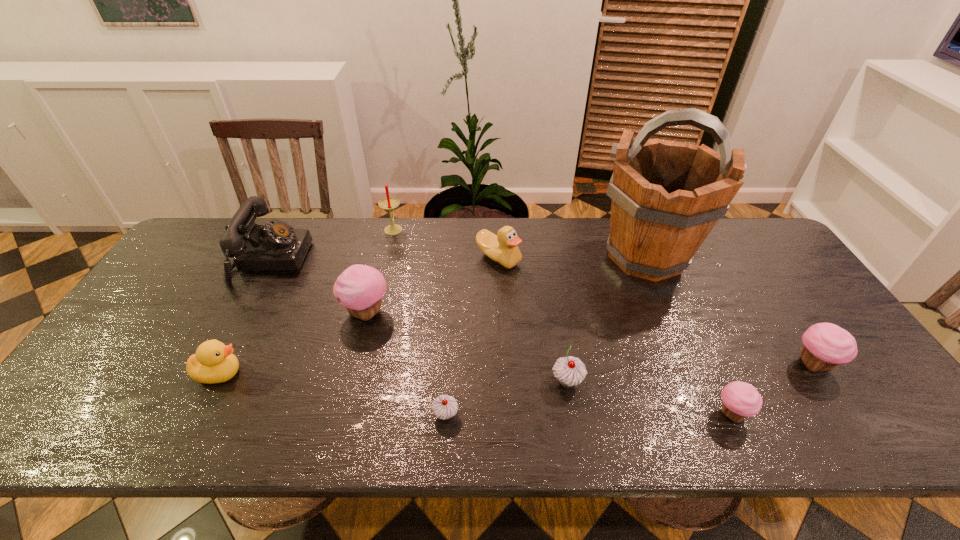
Locate an element on the screen. Image resolution: width=960 pixels, height=540 pixels. vacant space located 0.150m at the beak of the sixth object from left to right is located at coordinates (501, 310).

Find the location of a particular element. The height and width of the screenshot is (540, 960). vacant region located 0.130m on the right of the third cupcake from left to right is located at coordinates (638, 381).

Locate an element on the screen. This screenshot has width=960, height=540. free region located 0.100m on the left of the second nearest pink cupcake is located at coordinates (751, 364).

Identify the location of vacant space situated on the face of the duckling. The image size is (960, 540). (393, 373).

Find the location of `free space located on the right of the sixth object from right to left`. free space located on the right of the sixth object from right to left is located at coordinates (482, 415).

Find the location of a particular element. The width and height of the screenshot is (960, 540). vacant region located on the right of the nearest pink cupcake is located at coordinates (804, 414).

Locate an element on the screen. The height and width of the screenshot is (540, 960). bucket that is positioned at the far edge is located at coordinates (667, 196).

In order to click on candle located in the far edge section of the desktop in this screenshot , I will do `click(389, 203)`.

Identify the location of telephone situated at the far edge. The width and height of the screenshot is (960, 540). (276, 246).

Identify the location of duck present at the far edge. The height and width of the screenshot is (540, 960). (503, 248).